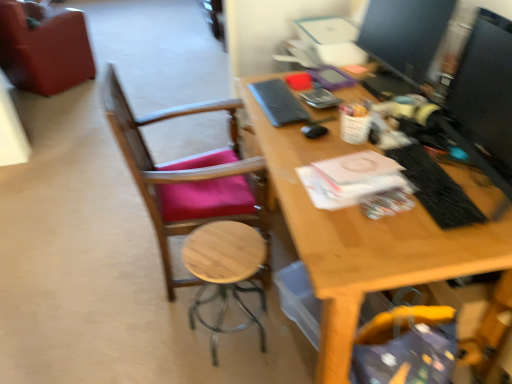
At what (x,y) coordinates should I click in order to perform the action: click on vacant area that lies between wooden chair at left, which is the 1th chair from bottom to top, and wooden stool at center. Please return your answer as a coordinate pair (x, y). Looking at the image, I should click on (192, 330).